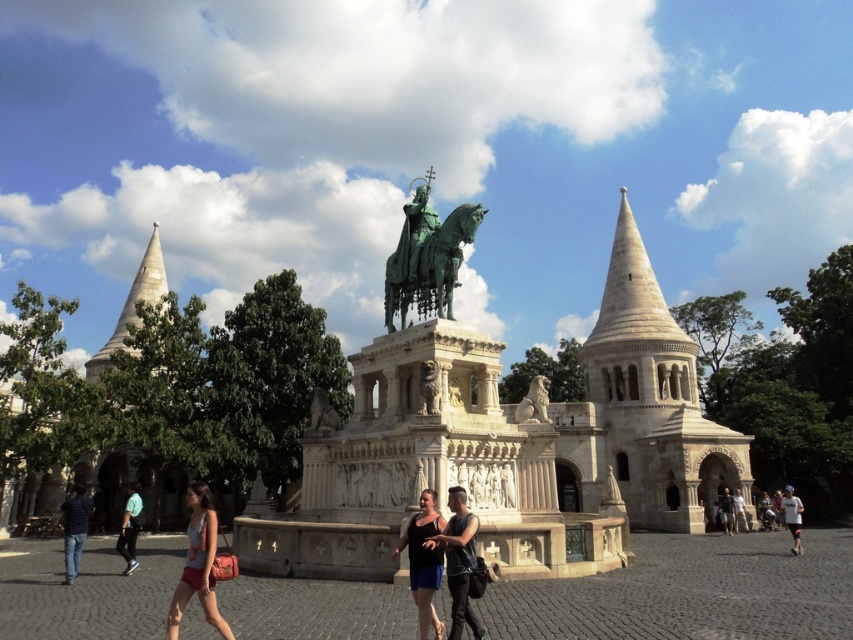
Question: Does black leather jacket at center have a smaller size compared to white cotton shirt at center?

Choices:
 (A) yes
 (B) no

Answer: (A)

Question: Considering the real-world distances, which object is farthest from the white stone palace at center?

Choices:
 (A) white stone lion at center
 (B) black matte tank top at center

Answer: (A)

Question: Based on their relative distances, which object is nearer to the green stone lion at center?

Choices:
 (A) white stone spire at upper right
 (B) black leather jacket at center
 (C) white stone tower at center
 (D) black matte tank top at center

Answer: (D)

Question: Which of these objects is positioned closest to the white cotton shirt at center?

Choices:
 (A) white stone spire at upper right
 (B) black matte tank top at center
 (C) white stone lion at center

Answer: (C)

Question: Can you confirm if white stone palace at center is positioned to the left of matte pink shorts at lower left?

Choices:
 (A) yes
 (B) no

Answer: (B)

Question: Does white stone palace at center have a smaller size compared to white stone tower at center?

Choices:
 (A) no
 (B) yes

Answer: (A)